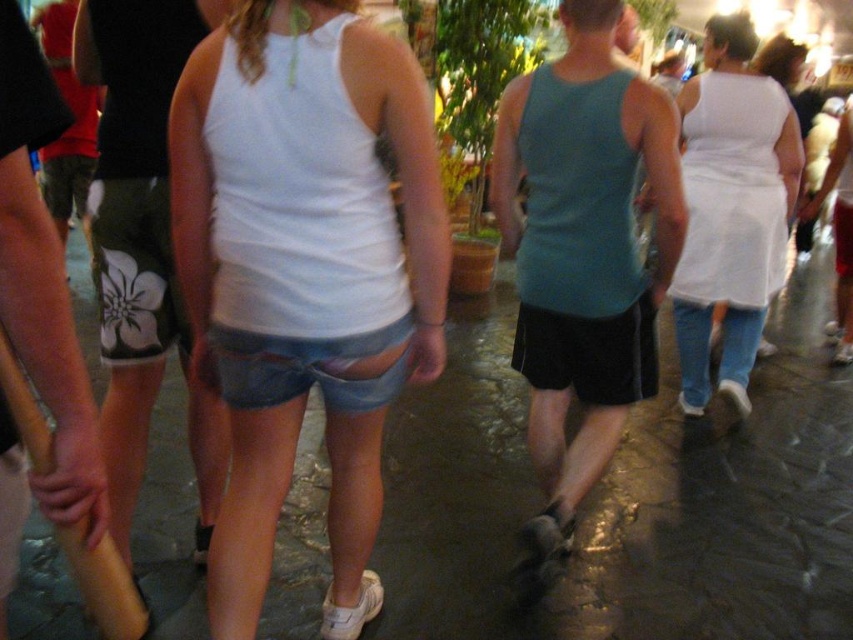
You are a photographer trying to capture a clear shot of the white matte tank top at center without including the wet stone pavement at center in the frame. Based on their relative widths, is this possible?

The wet stone pavement at center might be wider than the white matte tank top at center, so it might be challenging to capture the tank top without including the pavement in the frame if their widths overlap significantly.

You are standing at the point with coordinates point (x=717, y=296) and want to walk to the point with coordinates point (x=791, y=428). Is the point you want to reach in front of or behind you?

The point (x=791, y=428) is behind point (x=717, y=296), so the destination is behind you.